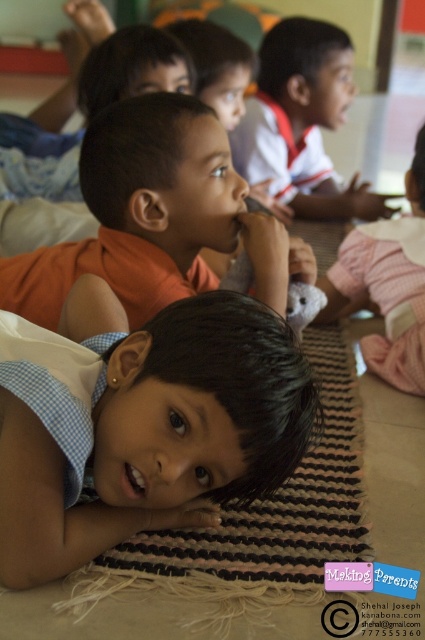
In the scene shown: Which is more to the right, blue checkered shirt at lower left or pink checkered shirt at lower right?

Positioned to the right is pink checkered shirt at lower right.

Between blue checkered shirt at lower left and pink checkered shirt at lower right, which one is positioned lower?

Positioned lower is blue checkered shirt at lower left.

What do you see at coordinates (142, 422) in the screenshot? This screenshot has height=640, width=425. I see `blue checkered shirt at lower left` at bounding box center [142, 422].

I want to click on blue checkered shirt at lower left, so click(142, 422).

Between orange matte shirt at center and pink checkered shirt at lower right, which one has less height?

With less height is orange matte shirt at center.

In order to click on orange matte shirt at center in this screenshot , I will do `click(139, 211)`.

Where is `orange matte shirt at center`? The image size is (425, 640). orange matte shirt at center is located at coordinates (139, 211).

Between blue checkered shirt at lower left and orange matte shirt at center, which one has less height?

Standing shorter between the two is orange matte shirt at center.

Between point (155, 513) and point (195, 118), which one is positioned in front?

Positioned in front is point (155, 513).

Between point (44, 429) and point (206, 186), which one is positioned behind?

The point (206, 186) is behind.

Locate an element on the screen. This screenshot has height=640, width=425. blue checkered shirt at lower left is located at coordinates (142, 422).